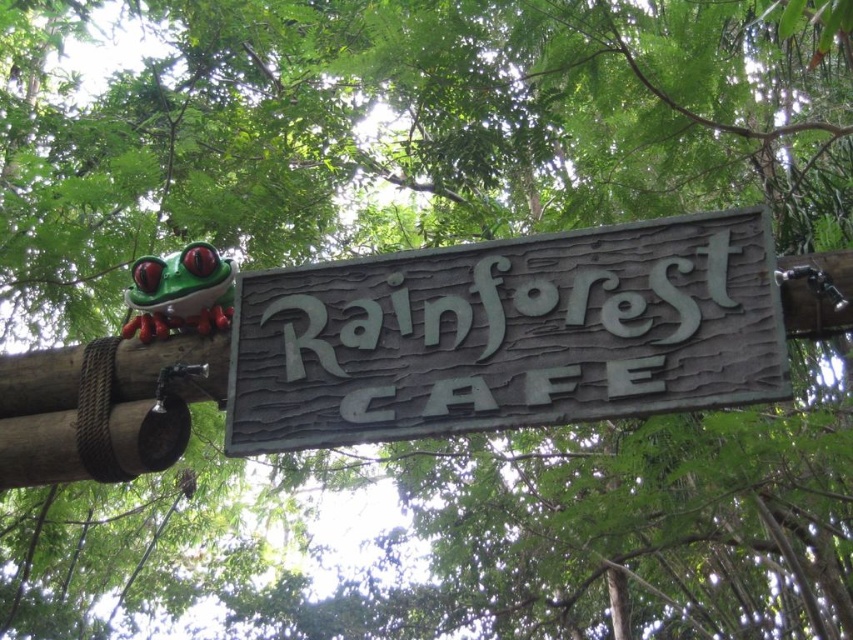
You are standing in front of the Rainforest Cafe sign and want to place a small decoration. You have two points marked on the wooden structure where you can place them. The first point is at coordinates point (x=280, y=429) and the second is at point (x=209, y=308). If you want to place a decoration closer to the viewer, which point should you choose?

Point (x=280, y=429) is in front of point (x=209, y=308), so you should choose point (x=280, y=429) to place the decoration closer to the viewer.

You are standing in front of the Rainforest Cafe sign and want to take a photo with your smartphone. The recommended distance for capturing the entire sign in the frame is 6 meters. Based on the scene description, will you be able to step back far enough to capture the entire green wood sign at center in your photo?

The green wood sign at center and camera are 6.95 meters apart from each other. Since the recommended distance is 6 meters, stepping back to 6.95 meters would allow you to capture the entire sign in the frame as you are slightly farther than the recommended distance.